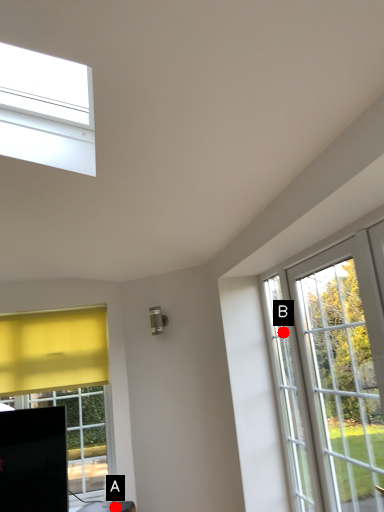
Question: Two points are circled on the image, labeled by A and B beside each circle. Which point is closer to the camera taking this photo?

Choices:
 (A) A is closer
 (B) B is closer

Answer: (B)